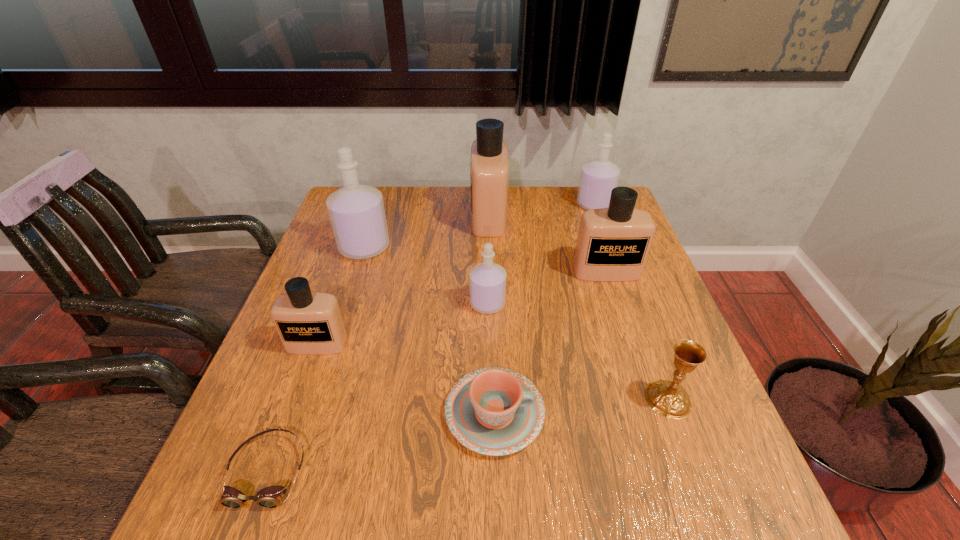
Find the location of `unoccupied area between the rightmost beige perfume and the gold chalice`. unoccupied area between the rightmost beige perfume and the gold chalice is located at coordinates [x=637, y=335].

Find the location of a particular element. The height and width of the screenshot is (540, 960). vacant space that's between the rightmost beige perfume and the chinaware is located at coordinates (550, 342).

In order to click on unoccupied area between the leftmost beige perfume and the second purple perfume from left to right in this screenshot , I will do `click(402, 323)`.

The image size is (960, 540). In order to click on empty location between the second smallest purple perfume and the nearest beige perfume in this screenshot , I will do `click(456, 274)`.

Find the location of a particular element. free space that is in between the shortest object and the rightmost purple perfume is located at coordinates (431, 337).

The width and height of the screenshot is (960, 540). What are the coordinates of `vacant space that's between the fifth farthest perfume and the second shortest object` in the screenshot? It's located at (492, 358).

Locate an element on the screen. object identified as the sixth closest to the second farthest purple perfume is located at coordinates (613, 243).

You are a GUI agent. You are given a task and a screenshot of the screen. Output one action in this format:
    pyautogui.click(x=<x>, y=<y>)
    Task: Click on the object that ranks as the second closest to the fourth nearest object
    Image resolution: width=960 pixels, height=540 pixels.
    Given the screenshot: What is the action you would take?
    pyautogui.click(x=494, y=411)

Locate an element on the screen. Image resolution: width=960 pixels, height=540 pixels. the fourth closest perfume to the smallest beige perfume is located at coordinates (613, 243).

Where is `perfume that is the fourth closest to the second beige perfume from left to right`? This screenshot has width=960, height=540. perfume that is the fourth closest to the second beige perfume from left to right is located at coordinates (598, 177).